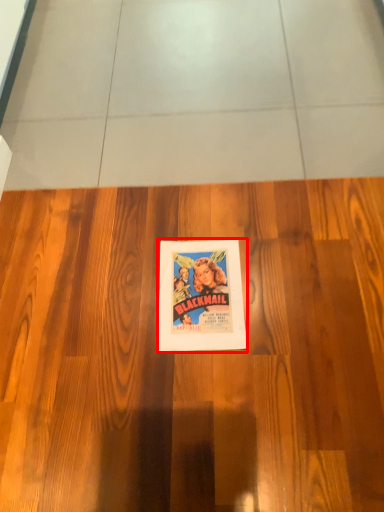
Question: From the image, what is the correct spatial relationship of poster (annotated by the red box) in relation to hardwood?

Choices:
 (A) right
 (B) left

Answer: (A)